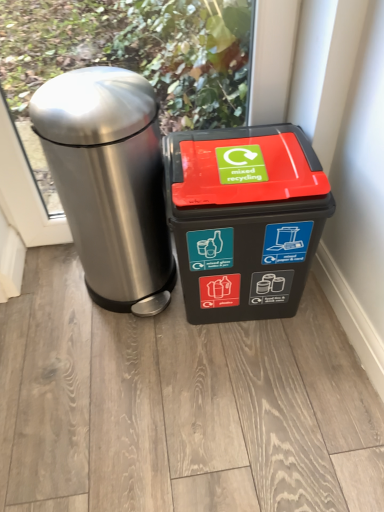
This screenshot has height=512, width=384. Find the location of `space that is in front of polished stainless steel trash can at left, arranged as the 1th waste container when viewed from the left`. space that is in front of polished stainless steel trash can at left, arranged as the 1th waste container when viewed from the left is located at coordinates (120, 361).